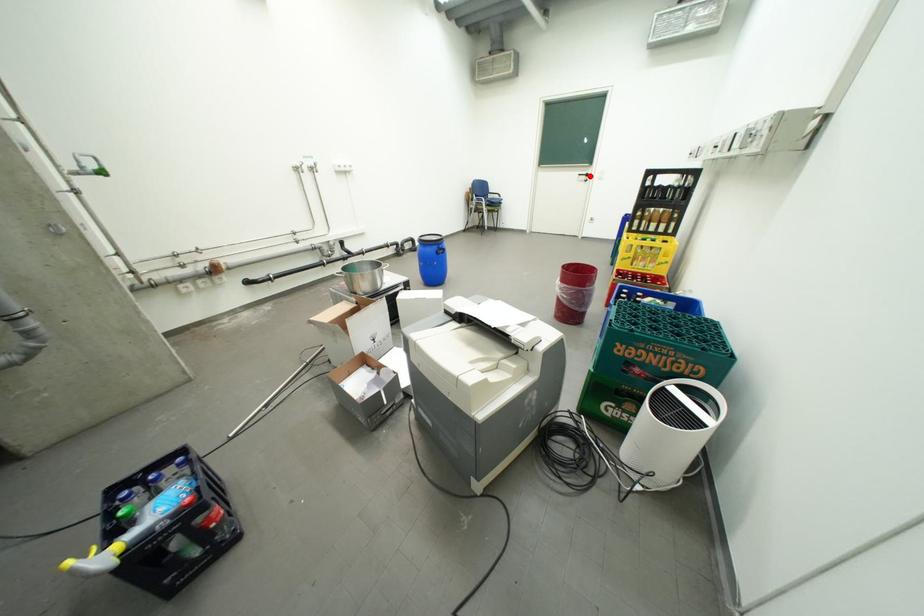
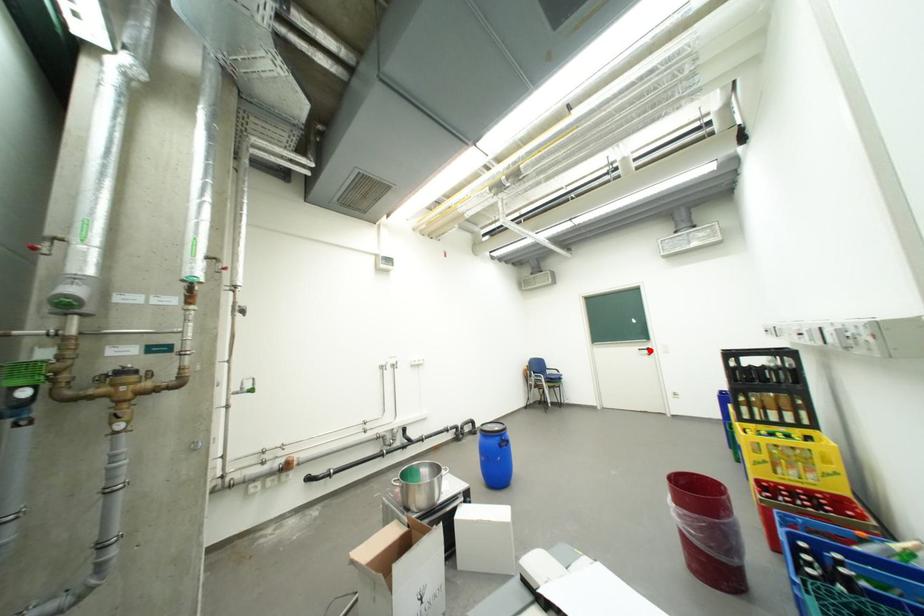
I am providing you with two images of the same scene from different viewpoints. A red point is marked on the first image and another point is marked on the second image. Is the red point in image1 aligned with the point shown in image2?

Yes